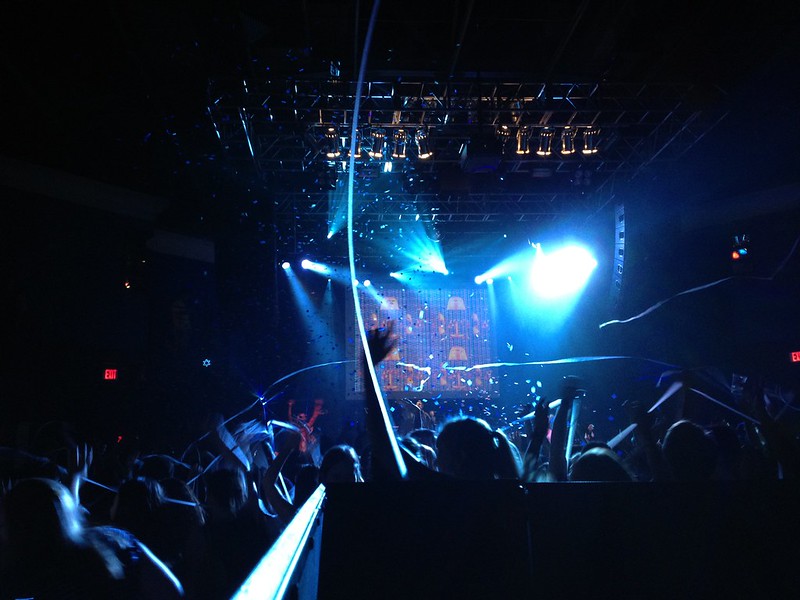
This screenshot has height=600, width=800. In order to click on exit sign in this screenshot , I will do `click(110, 374)`.